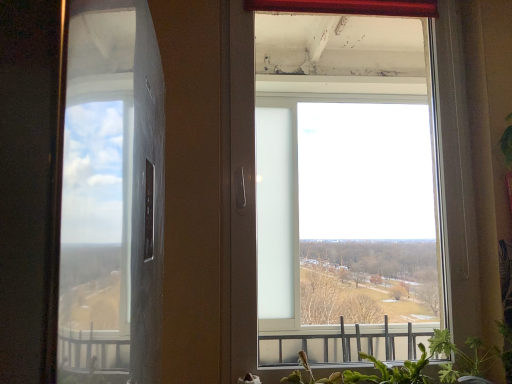
Image resolution: width=512 pixels, height=384 pixels. What do you see at coordinates (348, 183) in the screenshot?
I see `transparent glass window at center` at bounding box center [348, 183].

Locate an element on the screen. This screenshot has height=384, width=512. green leafy plant at lower right, arranged as the 1th plant when viewed from the right is located at coordinates (470, 356).

Is green leafy plant at lower right, placed as the 1th plant when sorted from left to right, next to transparent glass window at center?

green leafy plant at lower right, placed as the 1th plant when sorted from left to right, and transparent glass window at center are clearly separated.

Is green leafy plant at lower right, placed as the 1th plant when sorted from left to right, taller or shorter than transparent glass window at center?

Considering their sizes, green leafy plant at lower right, placed as the 1th plant when sorted from left to right, has less height than transparent glass window at center.

Is transparent glass window at center a part of green leafy plant at lower right, placed as the 1th plant when sorted from left to right?

No, transparent glass window at center is located outside of green leafy plant at lower right, placed as the 1th plant when sorted from left to right.

Would you say green leafy plant at lower right, placed as the 1th plant when sorted from left to right, is a long distance from green leafy plant at lower right, which is counted as the second plant, starting from the left?

Actually, green leafy plant at lower right, placed as the 1th plant when sorted from left to right, and green leafy plant at lower right, which is counted as the second plant, starting from the left, are a little close together.

Does point (377, 377) come in front of point (442, 366)?

Yes, point (377, 377) is closer to viewer.

This screenshot has height=384, width=512. Identify the location of plant that is on the left side of green leafy plant at lower right, arranged as the 1th plant when viewed from the right. (392, 371).

Which is more to the right, green leafy plant at lower right, arranged as the 1th plant when viewed from the right, or green leafy plant at lower right, acting as the 2th plant starting from the right?

From the viewer's perspective, green leafy plant at lower right, arranged as the 1th plant when viewed from the right, appears more on the right side.

Is green leafy plant at lower right, arranged as the 1th plant when viewed from the right, closer to camera compared to green leafy plant at lower right, placed as the 1th plant when sorted from left to right?

Yes, the depth of green leafy plant at lower right, arranged as the 1th plant when viewed from the right, is less than that of green leafy plant at lower right, placed as the 1th plant when sorted from left to right.

Consider the image. Looking at their sizes, would you say green leafy plant at lower right, which is counted as the second plant, starting from the left, is wider or thinner than green leafy plant at lower right, acting as the 2th plant starting from the right?

In the image, green leafy plant at lower right, which is counted as the second plant, starting from the left, appears to be wider than green leafy plant at lower right, acting as the 2th plant starting from the right.

Who is more distant, transparent glass window at center or green leafy plant at lower right, which is counted as the second plant, starting from the left?

transparent glass window at center.

Is transparent glass window at center far away from green leafy plant at lower right, which is counted as the second plant, starting from the left?

Yes, transparent glass window at center and green leafy plant at lower right, which is counted as the second plant, starting from the left, are located far from each other.

How many degrees apart are the facing directions of transparent glass window at center and green leafy plant at lower right, arranged as the 1th plant when viewed from the right?

2.31 degrees.

Is transparent glass window at center at the left side of green leafy plant at lower right, which is counted as the second plant, starting from the left?

Yes.

From the picture: How many degrees apart are the facing directions of green leafy plant at lower right, arranged as the 1th plant when viewed from the right, and transparent glass window at center?

2.31 degrees separate the facing orientations of green leafy plant at lower right, arranged as the 1th plant when viewed from the right, and transparent glass window at center.

Does green leafy plant at lower right, which is counted as the second plant, starting from the left, touch transparent glass window at center?

No, green leafy plant at lower right, which is counted as the second plant, starting from the left, is not beside transparent glass window at center.

Is green leafy plant at lower right, which is counted as the second plant, starting from the left, in front of or behind transparent glass window at center in the image?

Clearly, green leafy plant at lower right, which is counted as the second plant, starting from the left, is in front of transparent glass window at center.

Is green leafy plant at lower right, which is counted as the second plant, starting from the left, situated inside transparent glass window at center or outside?

green leafy plant at lower right, which is counted as the second plant, starting from the left, exists outside the volume of transparent glass window at center.

The height and width of the screenshot is (384, 512). Find the location of `window on the left of green leafy plant at lower right, placed as the 1th plant when sorted from left to right`. window on the left of green leafy plant at lower right, placed as the 1th plant when sorted from left to right is located at coordinates (348, 183).

Would you consider transparent glass window at center to be distant from green leafy plant at lower right, placed as the 1th plant when sorted from left to right?

That's right, there is a large distance between transparent glass window at center and green leafy plant at lower right, placed as the 1th plant when sorted from left to right.

Does transparent glass window at center turn towards green leafy plant at lower right, placed as the 1th plant when sorted from left to right?

Yes, transparent glass window at center is aimed at green leafy plant at lower right, placed as the 1th plant when sorted from left to right.

Identify the location of window behind the green leafy plant at lower right, placed as the 1th plant when sorted from left to right. The width and height of the screenshot is (512, 384). (348, 183).

There is a green leafy plant at lower right, acting as the 2th plant starting from the right. Find the location of `plant above it (from a real-world perspective)`. plant above it (from a real-world perspective) is located at coordinates (470, 356).

Considering their positions, is transparent glass window at center positioned further to green leafy plant at lower right, placed as the 1th plant when sorted from left to right, than green leafy plant at lower right, arranged as the 1th plant when viewed from the right?

Based on the image, transparent glass window at center appears to be further to green leafy plant at lower right, placed as the 1th plant when sorted from left to right.

Based on their spatial positions, is green leafy plant at lower right, arranged as the 1th plant when viewed from the right, or green leafy plant at lower right, placed as the 1th plant when sorted from left to right, closer to transparent glass window at center?

The object closer to transparent glass window at center is green leafy plant at lower right, placed as the 1th plant when sorted from left to right.

Looking at the image, which one is located further to green leafy plant at lower right, arranged as the 1th plant when viewed from the right, transparent glass window at center or green leafy plant at lower right, acting as the 2th plant starting from the right?

Among the two, transparent glass window at center is located further to green leafy plant at lower right, arranged as the 1th plant when viewed from the right.

Looking at the image, which one is located further to green leafy plant at lower right, arranged as the 1th plant when viewed from the right, green leafy plant at lower right, placed as the 1th plant when sorted from left to right, or transparent glass window at center?

Among the two, transparent glass window at center is located further to green leafy plant at lower right, arranged as the 1th plant when viewed from the right.

Based on their spatial positions, is green leafy plant at lower right, which is counted as the second plant, starting from the left, or transparent glass window at center further from green leafy plant at lower right, placed as the 1th plant when sorted from left to right?

The object further to green leafy plant at lower right, placed as the 1th plant when sorted from left to right, is transparent glass window at center.

Considering their positions, is green leafy plant at lower right, placed as the 1th plant when sorted from left to right, positioned closer to transparent glass window at center than green leafy plant at lower right, arranged as the 1th plant when viewed from the right?

green leafy plant at lower right, placed as the 1th plant when sorted from left to right, lies closer to transparent glass window at center than the other object.

In order to click on plant between transparent glass window at center and green leafy plant at lower right, acting as the 2th plant starting from the right, in the vertical direction in this screenshot , I will do `click(470, 356)`.